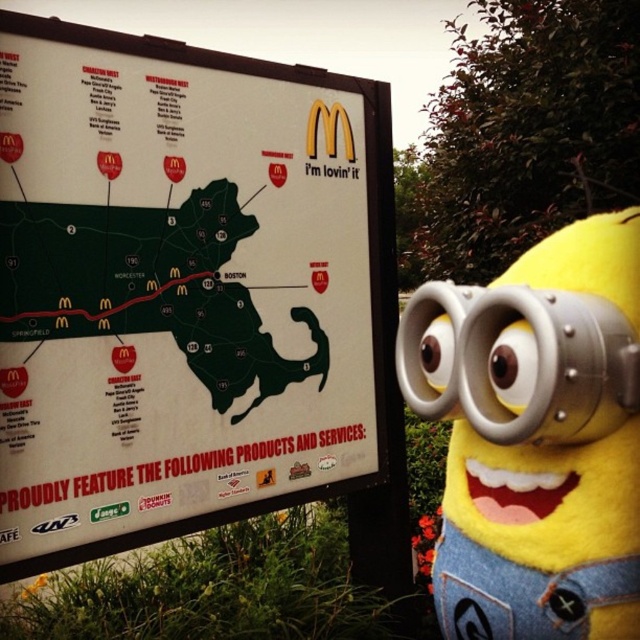
Question: Is green matte map at center further to the viewer compared to silver metallic goggles at center?

Choices:
 (A) yes
 (B) no

Answer: (A)

Question: Does white paper map at upper center appear under silver metallic goggles at center?

Choices:
 (A) no
 (B) yes

Answer: (A)

Question: Which object appears closest to the camera in this image?

Choices:
 (A) silver metallic goggles at center
 (B) green matte map at center
 (C) white paper map at upper center

Answer: (A)

Question: Which object is positioned farthest from the silver metallic goggles at center?

Choices:
 (A) white paper map at upper center
 (B) green matte map at center

Answer: (B)

Question: Does white paper map at upper center appear under silver metallic goggles at center?

Choices:
 (A) no
 (B) yes

Answer: (A)

Question: Which point is farther from the camera taking this photo?

Choices:
 (A) (531, 356)
 (B) (241, 312)

Answer: (B)